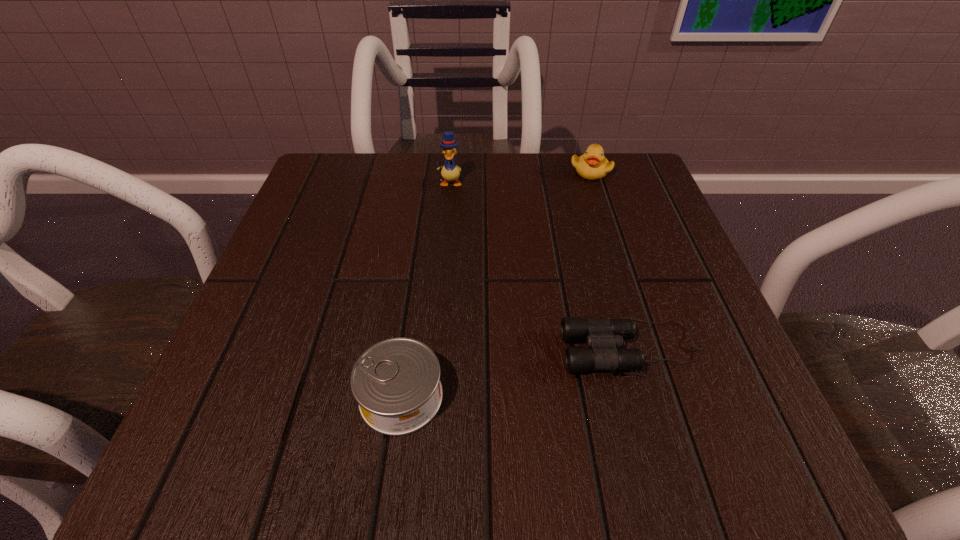
Image resolution: width=960 pixels, height=540 pixels. Identify the location of vacant space at the far right corner. (647, 205).

Locate an element on the screen. vacant area that lies between the binoculars and the left duckling is located at coordinates (540, 266).

Identify the location of unoccupied area between the shorter duckling and the can. The height and width of the screenshot is (540, 960). (496, 284).

This screenshot has height=540, width=960. I want to click on free space between the binoculars and the taller duckling, so click(x=540, y=266).

Image resolution: width=960 pixels, height=540 pixels. Find the location of `free space between the can and the binoculars`. free space between the can and the binoculars is located at coordinates (516, 372).

This screenshot has width=960, height=540. In order to click on free space that is in between the taller duckling and the can in this screenshot , I will do `click(425, 289)`.

You are a GUI agent. You are given a task and a screenshot of the screen. Output one action in this format:
    pyautogui.click(x=<x>, y=<y>)
    Task: Click on the free area in between the right duckling and the binoculars
    
    Given the screenshot: What is the action you would take?
    pyautogui.click(x=612, y=260)

The image size is (960, 540). Find the location of `free point between the left duckling and the can`. free point between the left duckling and the can is located at coordinates (425, 289).

At what (x,y) coordinates should I click in order to perform the action: click on free space that is in between the right duckling and the shortest object. Please return your answer as a coordinate pair (x, y). Looking at the image, I should click on point(612,260).

Locate an element on the screen. The width and height of the screenshot is (960, 540). free area in between the binoculars and the can is located at coordinates (516, 372).